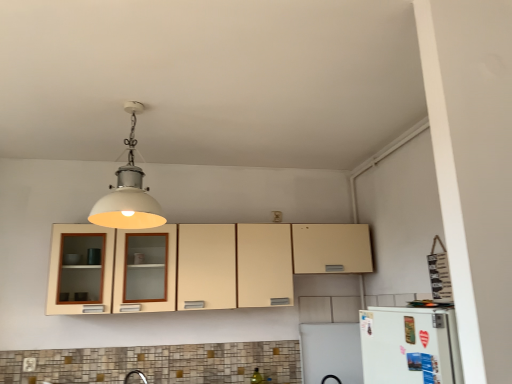
The image size is (512, 384). Find the location of `free space above white matte light fixture at upper center (from a real-world perspective)`. free space above white matte light fixture at upper center (from a real-world perspective) is located at coordinates (134, 106).